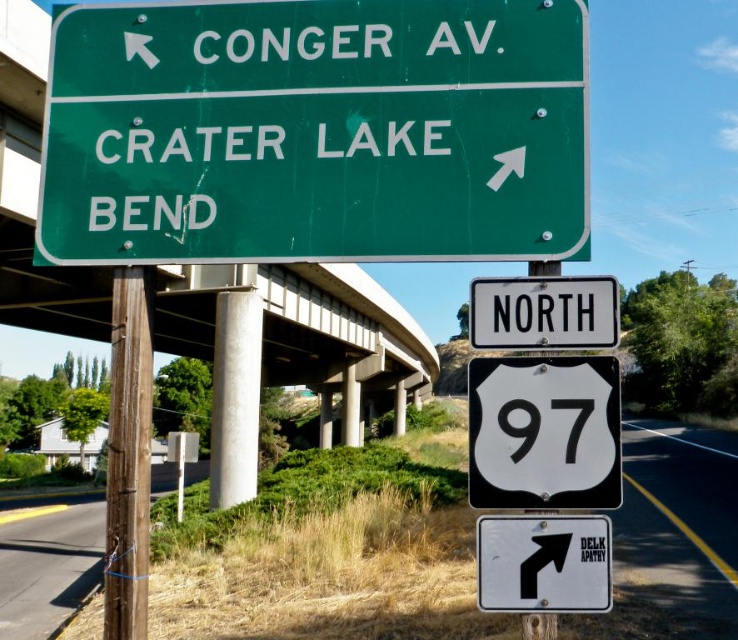
You are driving and see the white plastic highway sign at center and the white glossy shield at center. Which one appears closer to you?

The white plastic highway sign at center appears closer to you because the white glossy shield at center is behind it.